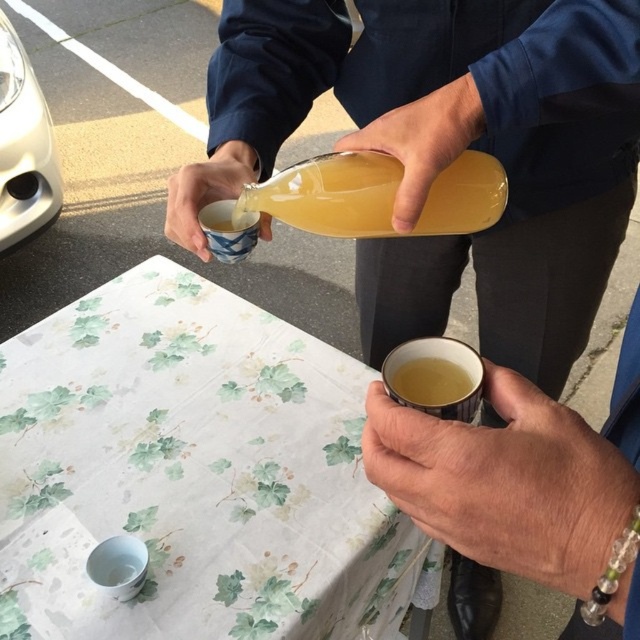
Between translucent glass bottle at upper center and yellow matte cup at lower center, which one has less height?

With less height is yellow matte cup at lower center.

Which of these two, translucent glass bottle at upper center or yellow matte cup at lower center, stands taller?

With more height is translucent glass bottle at upper center.

Does point (264, 205) come behind point (456, 372)?

Yes, it is behind point (456, 372).

Image resolution: width=640 pixels, height=640 pixels. Identify the location of translucent glass bottle at upper center. (330, 195).

Is matte ceramic cup at lower center shorter than white glossy car at upper left?

Correct, matte ceramic cup at lower center is not as tall as white glossy car at upper left.

Where is `matte ceramic cup at lower center`? The height and width of the screenshot is (640, 640). matte ceramic cup at lower center is located at coordinates (x=524, y=483).

Between translucent glass bottle at upper center and white glossy car at upper left, which one has less height?

With less height is translucent glass bottle at upper center.

Is point (394, 172) farther from camera compared to point (3, 116)?

That is False.

Is point (504, 208) positioned behind point (36, 90)?

No, (504, 208) is in front of (36, 90).

Image resolution: width=640 pixels, height=640 pixels. In order to click on translucent glass bottle at upper center in this screenshot , I will do `click(330, 195)`.